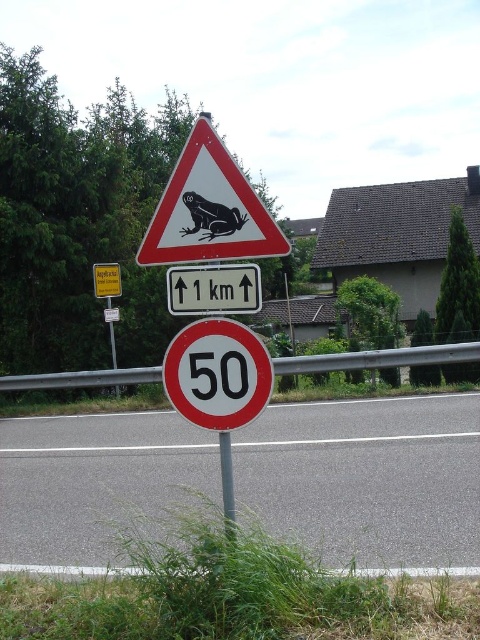
Question: From the image, what is the correct spatial relationship of white plastic sign at center in relation to yellow plastic sign at upper center?

Choices:
 (A) above
 (B) below

Answer: (B)

Question: Which object is closer to the camera taking this photo?

Choices:
 (A) white plastic sign at center
 (B) red metallic speed limit sign at center
 (C) yellow plastic sign at upper center
 (D) metallic pole at center

Answer: (D)

Question: Which object is positioned closest to the metallic pole at center?

Choices:
 (A) red metallic speed limit sign at center
 (B) matte plastic frog at upper center
 (C) white plastic sign at center
 (D) yellow plastic sign at upper center

Answer: (A)

Question: Does red metallic speed limit sign at center appear on the left side of metallic pole at center?

Choices:
 (A) yes
 (B) no

Answer: (A)

Question: Does matte plastic frog at upper center have a larger size compared to metallic pole at center?

Choices:
 (A) no
 (B) yes

Answer: (B)

Question: Which of the following is the farthest from the observer?

Choices:
 (A) (107, 276)
 (B) (260, 276)
 (C) (228, 518)

Answer: (A)